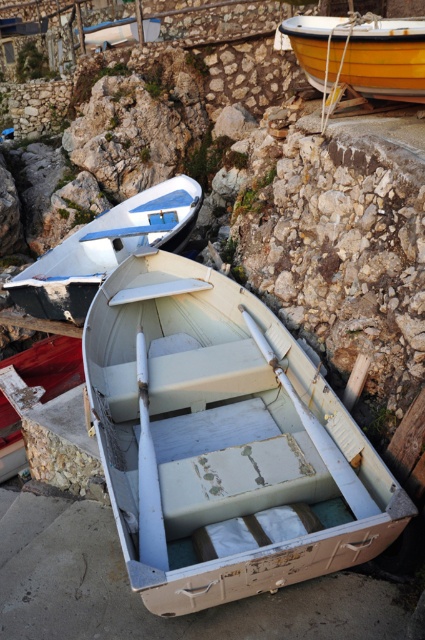
Does point (203, 550) come in front of point (376, 76)?

Yes, it is in front of point (376, 76).

Is white faded wood boat at center above yellow polished wood boat at upper right?

No, white faded wood boat at center is not above yellow polished wood boat at upper right.

Is point (370, 470) closer to camera compared to point (410, 83)?

That is True.

Locate an element on the screen. The image size is (425, 640). white faded wood boat at center is located at coordinates (223, 442).

In the scene shown: Can you confirm if white matte boat at upper center is smaller than yellow polished wood boat at upper right?

Incorrect, white matte boat at upper center is not smaller in size than yellow polished wood boat at upper right.

Who is more forward, (x=146, y=212) or (x=319, y=26)?

Point (x=319, y=26)

Find the location of `white matte boat at upper center`. white matte boat at upper center is located at coordinates (105, 248).

Is point (132, 449) farther from camera compared to point (170, 193)?

No, it is not.

You are a GUI agent. You are given a task and a screenshot of the screen. Output one action in this format:
    pyautogui.click(x=<x>, y=<y>)
    Task: Click on the white faded wood boat at center
    The width and height of the screenshot is (425, 640).
    Given the screenshot: What is the action you would take?
    pyautogui.click(x=223, y=442)